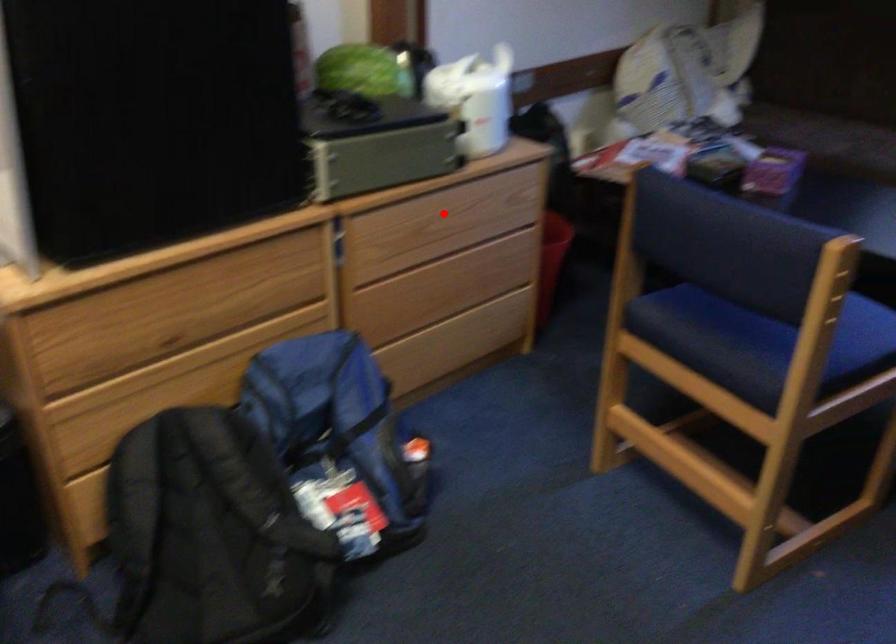
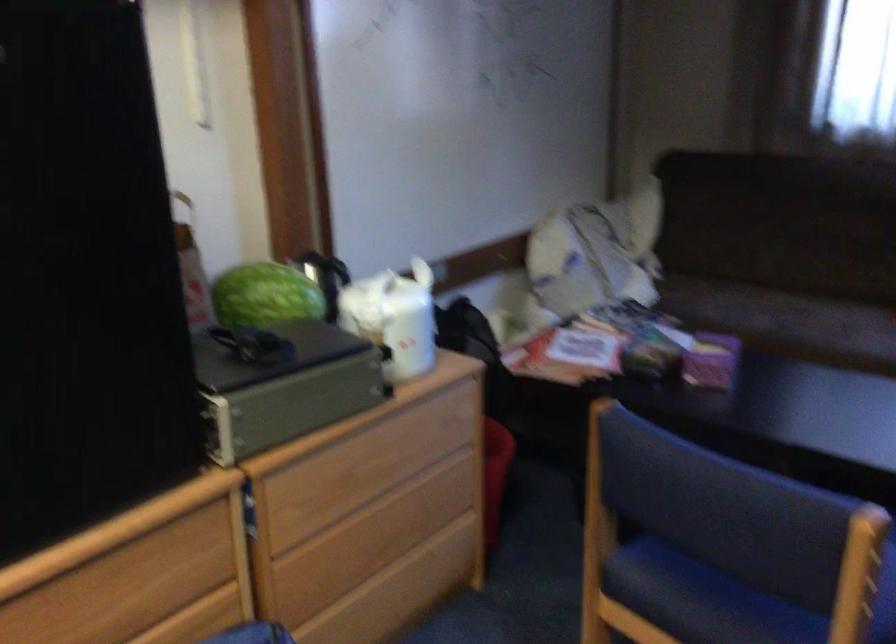
The point at the highlighted location is marked in the first image. Where is the corresponding point in the second image?

(373, 457)